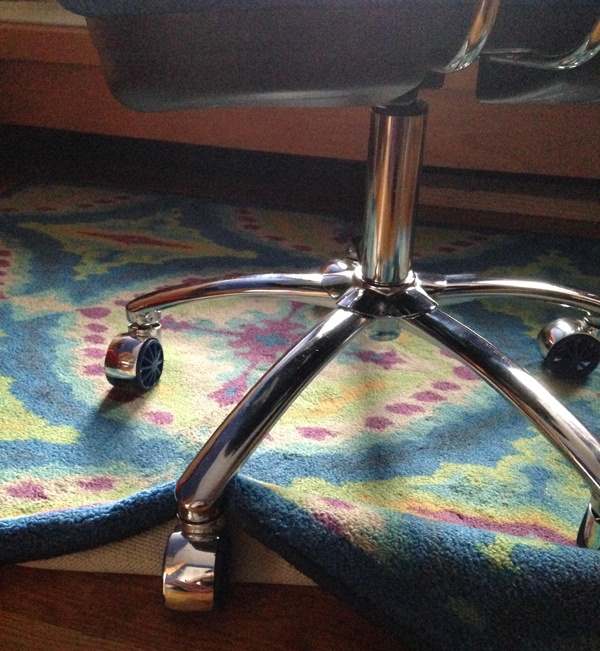
Locate an element on the screen. rug is located at coordinates (381, 443).